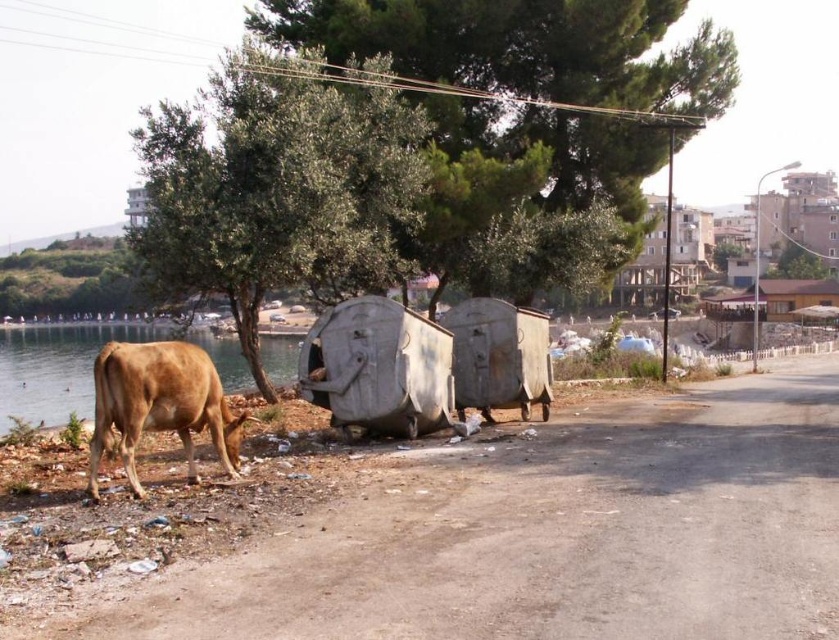
Between green leafy tree at upper center and brown matte cow at lower left, which one has more height?

With more height is green leafy tree at upper center.

Between point (357, 19) and point (210, 362), which one is positioned in front?

Positioned in front is point (210, 362).

I want to click on green leafy tree at upper center, so click(x=524, y=45).

Between point (172, 368) and point (79, 337), which one is positioned behind?

The point (79, 337) is behind.

Is brown matte cow at lower left bigger than brown leather cow at lower left?

Actually, brown matte cow at lower left might be smaller than brown leather cow at lower left.

Measure the distance between point (155, 385) and camera.

The distance of point (155, 385) from camera is 25.07 feet.

Identify the location of brown matte cow at lower left. Image resolution: width=839 pixels, height=640 pixels. (159, 404).

Is point (300, 244) farther from camera compared to point (520, 92)?

No, it is not.

Can you confirm if green leafy tree at upper left is wider than green leafy tree at upper center?

No, green leafy tree at upper left is not wider than green leafy tree at upper center.

Which is behind, point (168, 157) or point (623, 49)?

Positioned behind is point (623, 49).

Image resolution: width=839 pixels, height=640 pixels. Find the location of `green leafy tree at upper left`. green leafy tree at upper left is located at coordinates (280, 186).